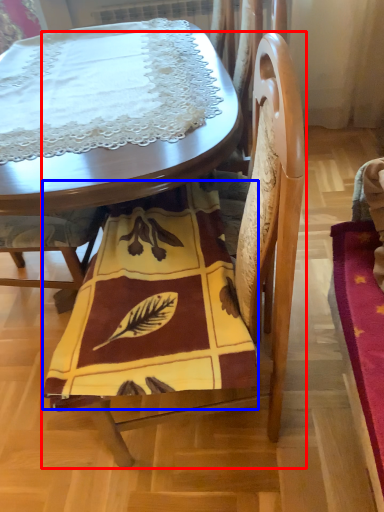
Question: Which object appears farthest to the camera in this image, chair (highlighted by a red box) or blanket (highlighted by a blue box)?

Choices:
 (A) chair
 (B) blanket

Answer: (B)